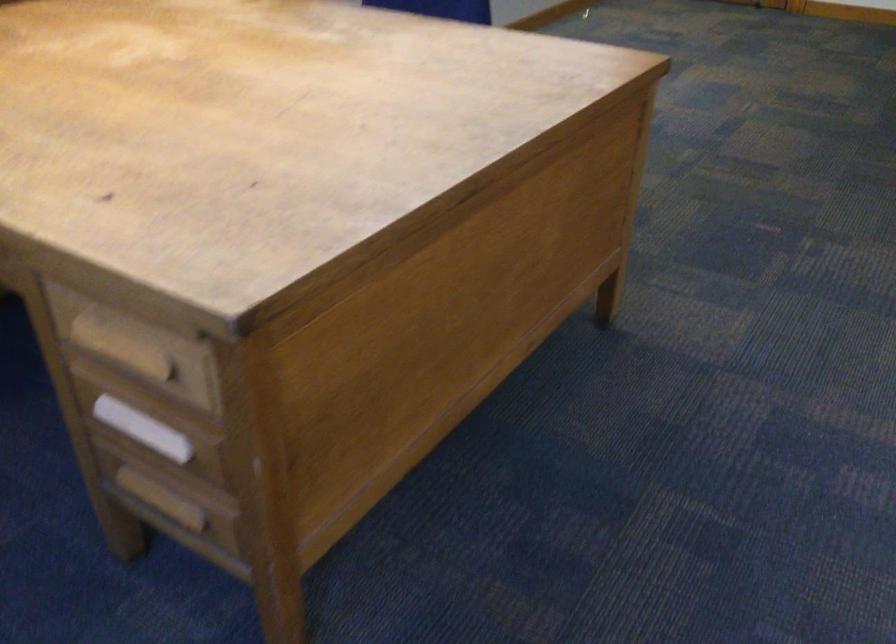
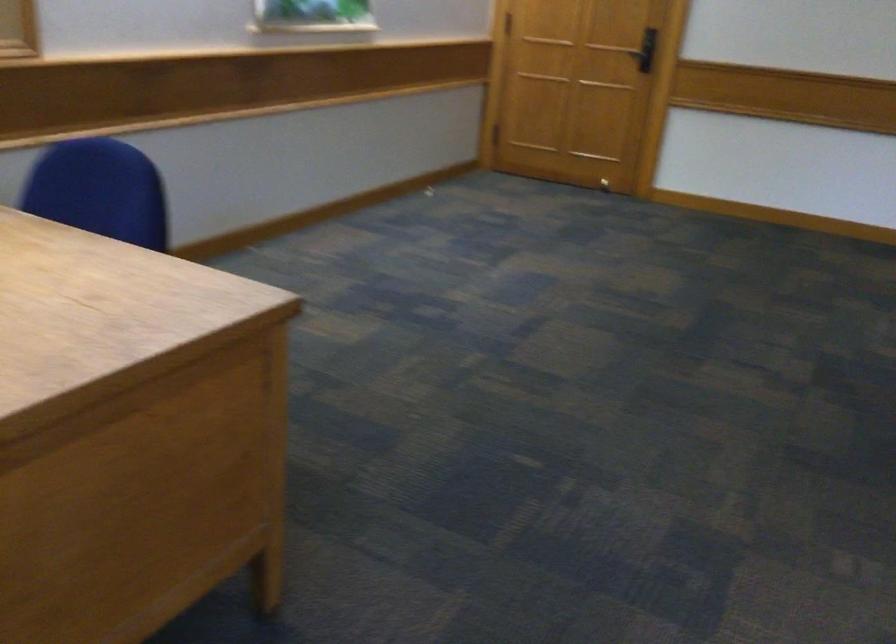
The images are taken continuously from a first-person perspective. In which direction are you moving?

The movement direction of the cameraman is right, forward.